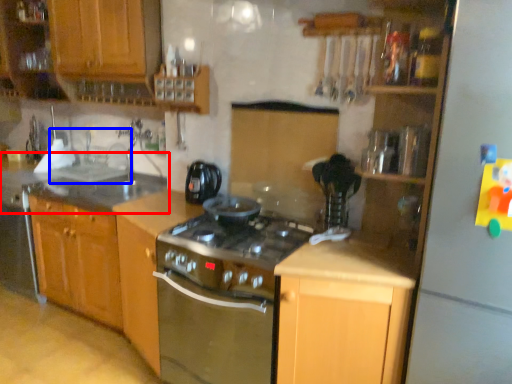
Question: Which point is further to the camera, countertop (highlighted by a red box) or sink (highlighted by a blue box)?

Choices:
 (A) countertop
 (B) sink

Answer: (B)